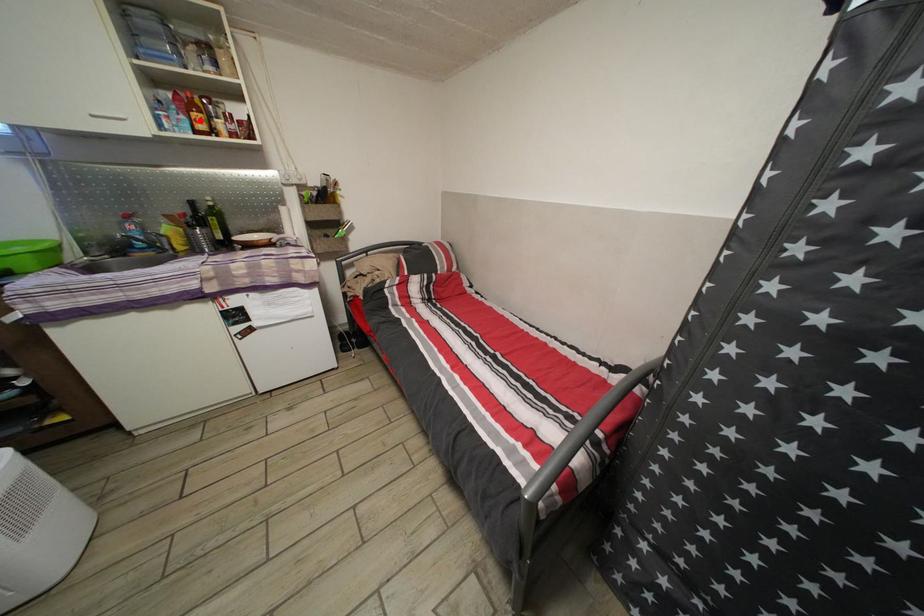
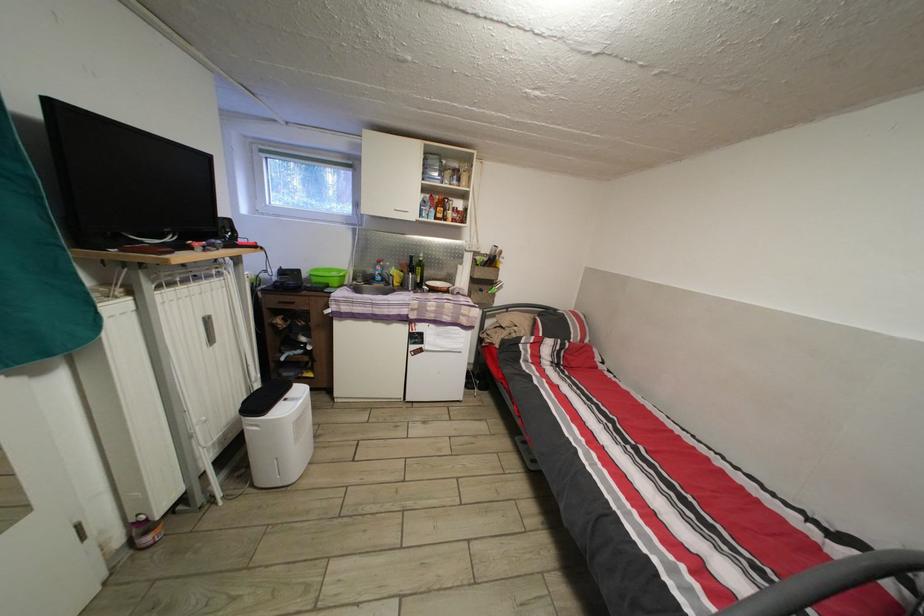
Locate, in the second image, the point that corresponds to the highlighted location in the first image.

(445, 215)